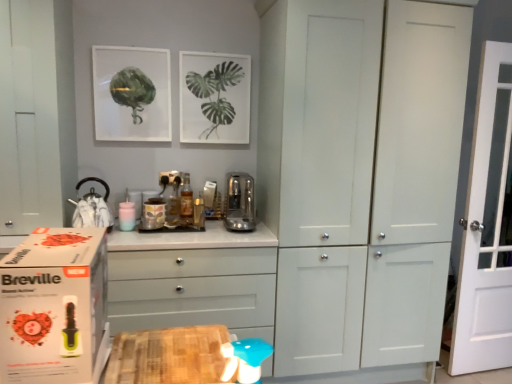
This screenshot has height=384, width=512. What do you see at coordinates (239, 202) in the screenshot? I see `satin silver toaster at center, the first appliance in the right-to-left sequence` at bounding box center [239, 202].

What is the approximate width of white matte cupboard at center?

white matte cupboard at center is 25.21 inches wide.

Where is `white cardboard box at left`? This screenshot has width=512, height=384. white cardboard box at left is located at coordinates (53, 306).

This screenshot has height=384, width=512. In order to click on white wooden door at right in this screenshot , I will do tap(487, 227).

Describe the element at coordinates (487, 227) in the screenshot. This screenshot has height=384, width=512. I see `white wooden door at right` at that location.

Identify the location of white matte cabinet at left. Image resolution: width=512 pixels, height=384 pixels. click(36, 115).

Is shiny silver kettle at left, which appears as the 1th appliance when viewed from the left, far from matte glass picture frame at upper left, the second picture frame when ordered from right to left?

No.

From a real-world perspective, which object rests below the other?

shiny silver kettle at left, arranged as the third appliance when viewed from the right.

Is shiny silver kettle at left, which appears as the 1th appliance when viewed from the left, taller or shorter than matte glass picture frame at upper left, the second picture frame when ordered from right to left?

shiny silver kettle at left, which appears as the 1th appliance when viewed from the left, is shorter than matte glass picture frame at upper left, the second picture frame when ordered from right to left.

From a real-world perspective, does white wooden door at right stand above shiny silver kettle at left, arranged as the third appliance when viewed from the right?

Incorrect, from a real-world perspective, white wooden door at right is lower than shiny silver kettle at left, arranged as the third appliance when viewed from the right.

Is white wooden door at right looking in the opposite direction of shiny silver kettle at left, arranged as the third appliance when viewed from the right?

white wooden door at right does not have its back to shiny silver kettle at left, arranged as the third appliance when viewed from the right.

Does white wooden door at right have a lesser width compared to shiny silver kettle at left, arranged as the third appliance when viewed from the right?

Yes, white wooden door at right is thinner than shiny silver kettle at left, arranged as the third appliance when viewed from the right.

Is white wooden door at right not inside shiny silver kettle at left, arranged as the third appliance when viewed from the right?

white wooden door at right lies outside shiny silver kettle at left, arranged as the third appliance when viewed from the right,'s area.

Is there a large distance between white glossy chest of drawers at center and shiny silver kettle at left, which appears as the 1th appliance when viewed from the left?

No, white glossy chest of drawers at center is in close proximity to shiny silver kettle at left, which appears as the 1th appliance when viewed from the left.

From a real-world perspective, starting from the white glossy chest of drawers at center, which appliance is the 3rd one vertically above it? Please provide its 2D coordinates.

[(92, 208)]

Considering the relative sizes of white glossy chest of drawers at center and shiny silver kettle at left, which appears as the 1th appliance when viewed from the left, in the image provided, is white glossy chest of drawers at center thinner than shiny silver kettle at left, which appears as the 1th appliance when viewed from the left,?

No, white glossy chest of drawers at center is not thinner than shiny silver kettle at left, which appears as the 1th appliance when viewed from the left.

Would you say white wooden door at right is part of white glossy chest of drawers at center's contents?

No.

Consider the image. Which is more to the right, white glossy chest of drawers at center or white wooden door at right?

From the viewer's perspective, white wooden door at right appears more on the right side.

From a real-world perspective, who is located lower, white glossy chest of drawers at center or white wooden door at right?

white glossy chest of drawers at center, from a real-world perspective.

Find the location of a particular element. The width and height of the screenshot is (512, 384). toy on the left of white matte cupboard at center is located at coordinates (245, 359).

Which of these two, blue plastic toy at lower center or white matte cupboard at center, is wider?

With larger width is white matte cupboard at center.

Based on the photo, does blue plastic toy at lower center have a smaller size compared to white matte cupboard at center?

Indeed, blue plastic toy at lower center has a smaller size compared to white matte cupboard at center.

Can you confirm if white glossy chest of drawers at center is smaller than white cardboard box at left?

No.

From the image's perspective, between white glossy chest of drawers at center and white cardboard box at left, who is located below?

white glossy chest of drawers at center is shown below in the image.

Which is more to the right, white glossy chest of drawers at center or white cardboard box at left?

white cardboard box at left.

Is white cardboard box at left at the back of white glossy chest of drawers at center?

white glossy chest of drawers at center does not have its back to white cardboard box at left.

Is matte glass picture frame at upper left, the second picture frame when ordered from right to left, looking in the opposite direction of matte ceramic jar at center, acting as the second appliance starting from the left?

No, matte glass picture frame at upper left, the second picture frame when ordered from right to left, is not facing away from matte ceramic jar at center, acting as the second appliance starting from the left.

Which is behind, point (108, 95) or point (154, 199)?

Point (154, 199)

From a real-world perspective, is matte glass picture frame at upper left, the second picture frame when ordered from right to left, physically below matte ceramic jar at center, acting as the second appliance starting from the left?

No.

Which object is positioned more to the right, matte glass picture frame at upper left, the 1th picture frame positioned from the left, or matte ceramic jar at center, which is the 2th appliance in right-to-left order?

From the viewer's perspective, matte ceramic jar at center, which is the 2th appliance in right-to-left order, appears more on the right side.

I want to click on the 1st appliance below the matte glass picture frame at upper left, the 1th picture frame positioned from the left (from a real-world perspective), so click(92, 208).

In order to click on the 2nd appliance above the white wooden door at right (from the image's perspective) in this screenshot , I will do `click(92, 208)`.

Estimate the real-world distances between objects in this image. Which object is further from satin silver toaster at center, which is the third appliance in left-to-right order, shiny silver kettle at left, which appears as the 1th appliance when viewed from the left, or white cardboard box at left?

Based on the image, white cardboard box at left appears to be further to satin silver toaster at center, which is the third appliance in left-to-right order.

Based on their spatial positions, is white wooden door at right or matte ceramic jar at center, which is the 2th appliance in right-to-left order, closer to white matte cabinet at left?

matte ceramic jar at center, which is the 2th appliance in right-to-left order.

Estimate the real-world distances between objects in this image. Which object is further from white cardboard box at left, shiny silver kettle at left, which appears as the 1th appliance when viewed from the left, or satin silver toaster at center, which is the third appliance in left-to-right order?

satin silver toaster at center, which is the third appliance in left-to-right order.

When comparing their distances from white matte cabinet at left, does shiny silver kettle at left, which appears as the 1th appliance when viewed from the left, or satin silver toaster at center, which is the third appliance in left-to-right order, seem further?

satin silver toaster at center, which is the third appliance in left-to-right order, is further to white matte cabinet at left.

Based on the photo, which object lies further to the anchor point blue plastic toy at lower center, white glossy chest of drawers at center or white wooden door at right?

white wooden door at right lies further to blue plastic toy at lower center than the other object.

Looking at the image, which one is located further to white glossy chest of drawers at center, satin silver toaster at center, which is the third appliance in left-to-right order, or white matte cabinet at left?

white matte cabinet at left.

When comparing their distances from white cardboard box at left, does matte glass picture frame at upper left, the second picture frame when ordered from right to left, or white glossy chest of drawers at center seem closer?

white glossy chest of drawers at center lies closer to white cardboard box at left than the other object.

From the picture: Estimate the real-world distances between objects in this image. Which object is further from white matte cupboard at center, white matte cabinet at left or satin silver toaster at center, which is the third appliance in left-to-right order?

white matte cabinet at left is further to white matte cupboard at center.

Identify the location of picture frame that lies between matte glass picture frame at upper left, the 1th picture frame positioned from the left, and satin silver toaster at center, which is the third appliance in left-to-right order, from top to bottom. (214, 98).

You are a GUI agent. You are given a task and a screenshot of the screen. Output one action in this format:
    pyautogui.click(x=<x>, y=<y>)
    Task: Click on the picture frame between matte glass picture frame at upper left, the 1th picture frame positioned from the left, and white wooden door at right, in the horizontal direction
    
    Given the screenshot: What is the action you would take?
    pyautogui.click(x=214, y=98)

What are the coordinates of `cardboard box between matte ceramic jar at center, acting as the second appliance starting from the left, and white wooden door at right from left to right` in the screenshot? It's located at (53, 306).

Where is `cardboard box between blue plastic toy at lower center and white glossy chest of drawers at center in the front-back direction`? This screenshot has height=384, width=512. cardboard box between blue plastic toy at lower center and white glossy chest of drawers at center in the front-back direction is located at coordinates (53, 306).